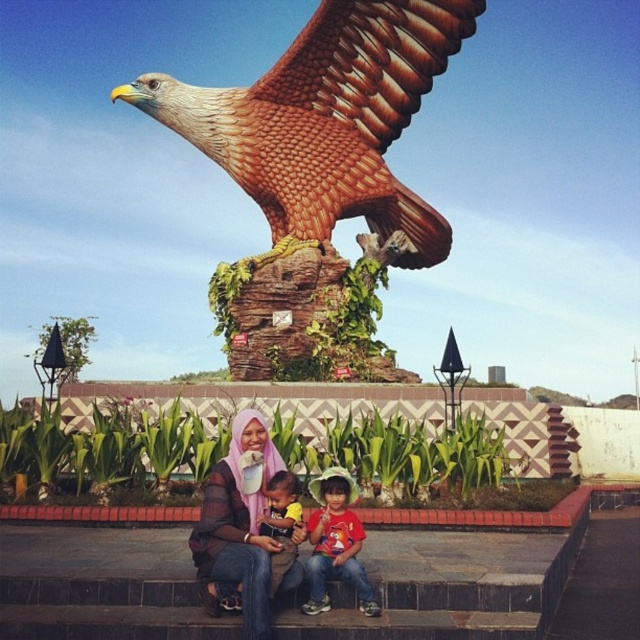
Based on the photo, you are a photographer trying to capture the statue of the eagle and the people in the foreground. You notice the pink sheer hijab at center and the soft yellow fabric shirt at center. Which clothing item should you focus on to ensure it stands out more due to its size?

The pink sheer hijab at center is bigger than the soft yellow fabric shirt at center, so focusing on the pink sheer hijab at center will make it stand out more due to its larger size.

You are standing in front of the statue and want to take a photo of the brown glossy eagle at upper center. The camera you are using has a maximum zoom range of 100 meters. Can you capture the eagle in full detail without moving closer?

The distance between the brown glossy eagle at upper center and the camera is 87.45 meters. Since the camera can zoom up to 100 meters, you can capture the eagle in full detail without moving closer.

You are a tourist standing in front of the statue and notice the brown glossy eagle at upper center and the pink sheer hijab at center. Which object is closer to you from your current viewpoint?

The brown glossy eagle at upper center is closer to you because the pink sheer hijab at center is positioned behind it.